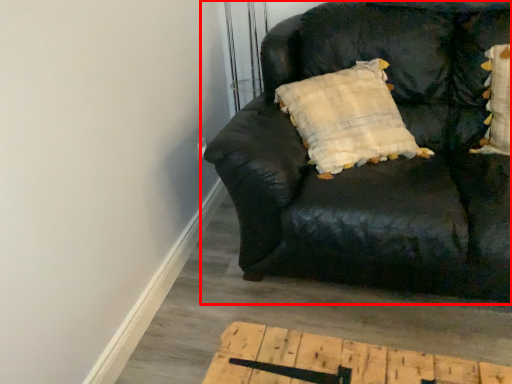
Question: In this image, where is studio couch (annotated by the red box) located relative to pillow?

Choices:
 (A) right
 (B) left

Answer: (B)